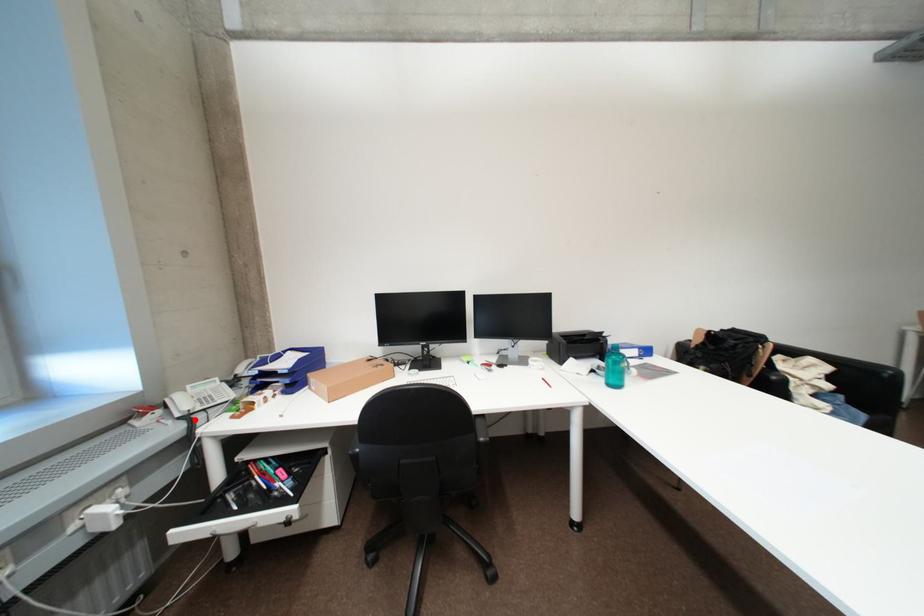
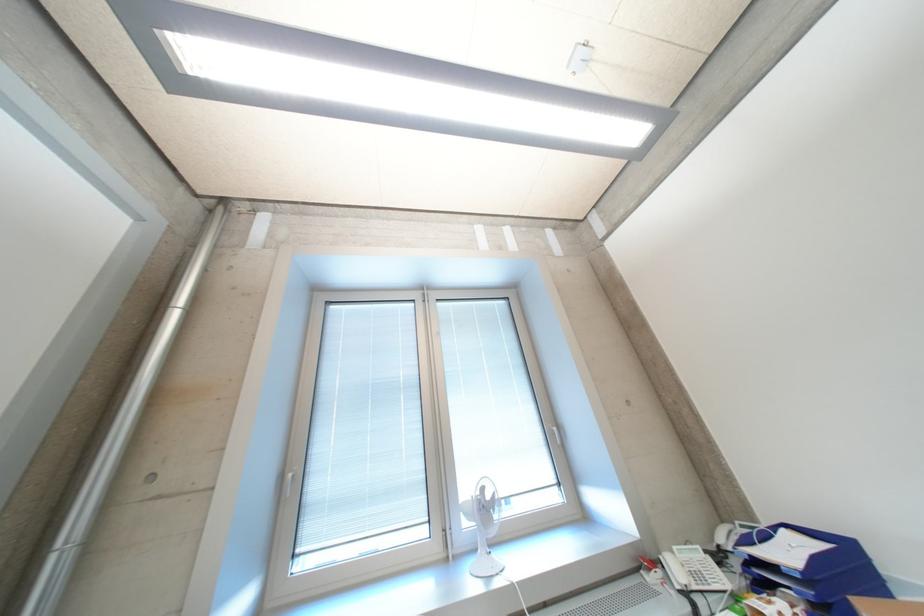
Question: I am providing you with two images of the same scene from different viewpoints. Image1 has a red point marked. In image2, the corresponding 3D location appears at what relative position? Reply with the corresponding letter.

Choices:
 (A) Closer
 (B) Farther

Answer: (A)